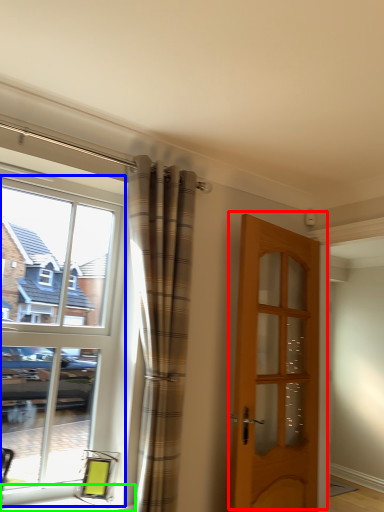
Question: Considering the real-world distances, which object is farthest from door (highlighted by a red box)? window (highlighted by a blue box) or window sill (highlighted by a green box)?

Choices:
 (A) window
 (B) window sill

Answer: (B)